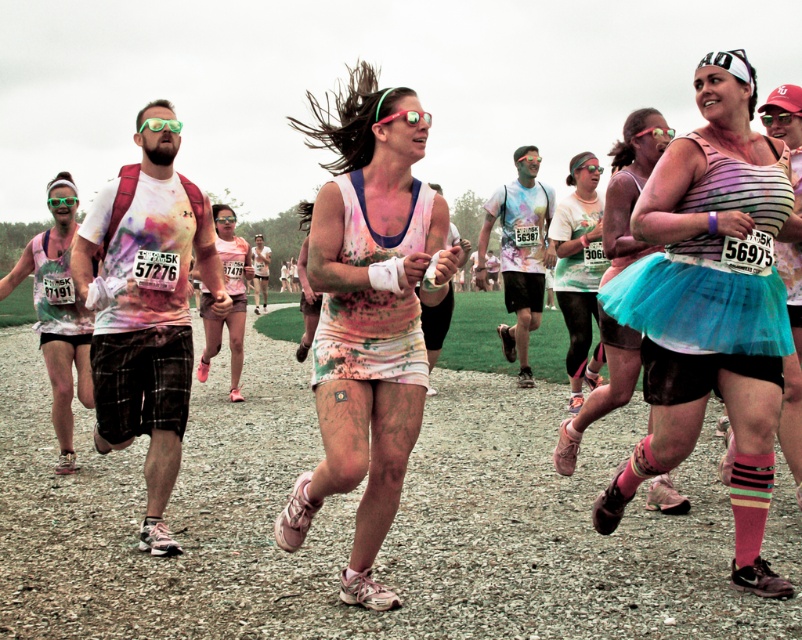
You are a photographer at the color run event. You want to take a photo that includes both the point at location point (333, 481) and point (561, 243). Which point should you focus on to ensure both are in focus?

You should focus on point (333, 481) because it is closer to the camera, and focusing on the closer point will keep both points in focus.

You are a photographer standing at the camera position. You want to capture a closeup shot of the point at coordinates point (331,216). Your camera has a focal length of 50mm and a sensor size of 24mm x 36mm. What is the minimum distance you need to move forward to ensure the point fills the frame vertically?

The point at coordinates point (331,216) is 4.06 meters away from the camera. To calculate the minimum distance to move forward, first determine the vertical field of view using the focal length and sensor height. The vertical field of view is 2 times arctangent of half the sensor height divided by the focal length. Half the sensor height is 12mm. So, arctangent of 12mm divided by 50mm equals approximately 11.3 degrees. The total vertical field of view is 22.6 degrees. The point needs to fill the frame,

You are a photographer at the color run event and want to capture the runner wearing the matte teal tutu skirt at center. According to the scene description, where should you focus your camera to ensure the skirt is in the frame?

The matte teal tutu skirt at center is located at the 2D coordinates point [630,186], so you should focus your camera at that point to capture the skirt in the frame.